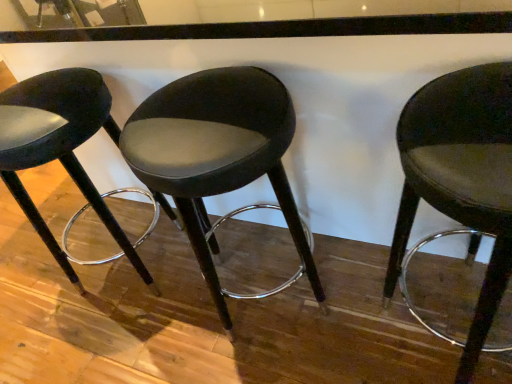
Question: Considering the relative sizes of satin black stool at left, which ranks as the third chair in right-to-left order, and matte black stool at right, which is the 3th chair from left to right, in the image provided, is satin black stool at left, which ranks as the third chair in right-to-left order, thinner than matte black stool at right, which is the 3th chair from left to right,?

Choices:
 (A) yes
 (B) no

Answer: (B)

Question: Is satin black stool at left, acting as the 1th chair starting from the left, oriented away from matte black stool at right, which is the 3th chair from left to right?

Choices:
 (A) yes
 (B) no

Answer: (B)

Question: Is matte black stool at right, placed as the 1th chair when sorted from right to left, inside satin black stool at left, acting as the 1th chair starting from the left?

Choices:
 (A) no
 (B) yes

Answer: (A)

Question: Is satin black stool at left, acting as the 1th chair starting from the left, in front of matte black stool at right, placed as the 1th chair when sorted from right to left?

Choices:
 (A) yes
 (B) no

Answer: (B)

Question: Is satin black stool at left, acting as the 1th chair starting from the left, aimed at matte black stool at right, placed as the 1th chair when sorted from right to left?

Choices:
 (A) no
 (B) yes

Answer: (A)

Question: From a real-world perspective, is matte black stool at right, which is the 3th chair from left to right, above or below satin black stool at left, acting as the 1th chair starting from the left?

Choices:
 (A) below
 (B) above

Answer: (A)

Question: From the image's perspective, is matte black stool at right, which is the 3th chair from left to right, located above or below satin black stool at left, acting as the 1th chair starting from the left?

Choices:
 (A) above
 (B) below

Answer: (B)

Question: Is point (445, 104) closer or farther from the camera than point (68, 132)?

Choices:
 (A) farther
 (B) closer

Answer: (B)

Question: Is matte black stool at right, placed as the 1th chair when sorted from right to left, bigger or smaller than satin black stool at left, which ranks as the third chair in right-to-left order?

Choices:
 (A) big
 (B) small

Answer: (B)

Question: Considering their positions, is satin black stool at left, which ranks as the third chair in right-to-left order, located in front of or behind suede-like black stool at center, arranged as the second chair when viewed from the left?

Choices:
 (A) behind
 (B) front

Answer: (A)

Question: From a real-world perspective, is satin black stool at left, acting as the 1th chair starting from the left, positioned above or below suede-like black stool at center, the 2th chair positioned from the right?

Choices:
 (A) below
 (B) above

Answer: (B)

Question: Is satin black stool at left, acting as the 1th chair starting from the left, inside the boundaries of suede-like black stool at center, the 2th chair positioned from the right, or outside?

Choices:
 (A) inside
 (B) outside

Answer: (B)

Question: In terms of height, does satin black stool at left, which ranks as the third chair in right-to-left order, look taller or shorter compared to suede-like black stool at center, the 2th chair positioned from the right?

Choices:
 (A) short
 (B) tall

Answer: (A)

Question: From the image's perspective, is suede-like black stool at center, arranged as the second chair when viewed from the left, positioned above or below matte black stool at right, placed as the 1th chair when sorted from right to left?

Choices:
 (A) above
 (B) below

Answer: (A)

Question: Is suede-like black stool at center, arranged as the second chair when viewed from the left, in front of or behind matte black stool at right, which is the 3th chair from left to right, in the image?

Choices:
 (A) front
 (B) behind

Answer: (B)